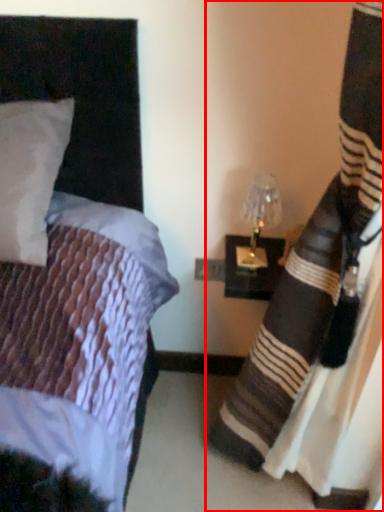
Question: In this image, where is curtain (annotated by the red box) located relative to bedside lamp?

Choices:
 (A) left
 (B) right

Answer: (B)